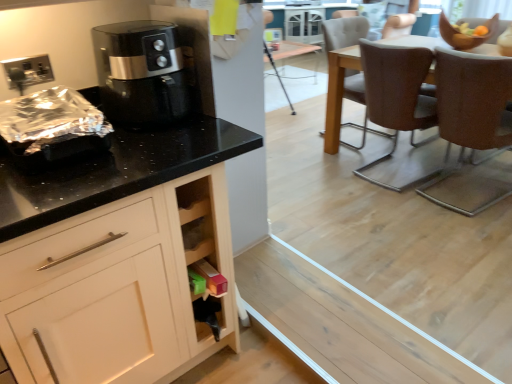
Question: In terms of height, does brown textured chair at right, placed as the third chair when sorted from front to back, look taller or shorter compared to brown leather chair at center, marked as the second chair in a back-to-front arrangement?

Choices:
 (A) short
 (B) tall

Answer: (B)

Question: Relative to brown leather chair at center, marked as the second chair in a back-to-front arrangement, is brown textured chair at right, placed as the third chair when sorted from front to back, in front or behind?

Choices:
 (A) behind
 (B) front

Answer: (A)

Question: Considering the real-world distances, which object is closest to the brown leather chair at right, which is the 1th chair from front to back?

Choices:
 (A) brown leather chair at center, marked as the second chair in a back-to-front arrangement
 (B) brown textured chair at right, placed as the third chair when sorted from front to back
 (C) black glossy air fryer at upper left
 (D) wooden cabinet at lower center

Answer: (A)

Question: Estimate the real-world distances between objects in this image. Which object is farther from the brown leather chair at right, which is the 1th chair from front to back?

Choices:
 (A) brown leather chair at center, marked as the second chair in a back-to-front arrangement
 (B) black glossy air fryer at upper left
 (C) wooden cabinet at lower center
 (D) brown textured chair at right, placed as the third chair when sorted from front to back

Answer: (C)